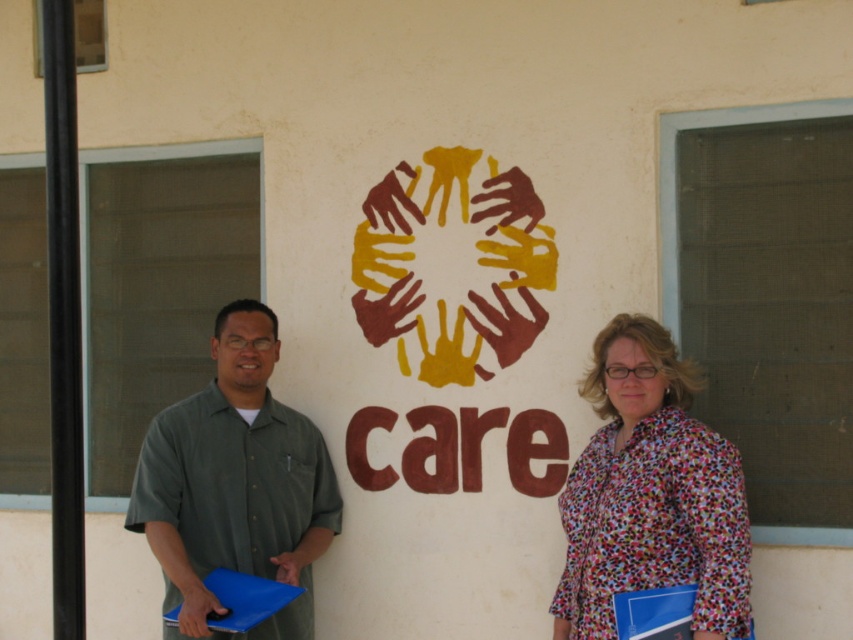
Question: Which point appears farthest from the camera in this image?

Choices:
 (A) (666, 364)
 (B) (256, 429)
 (C) (233, 355)
 (D) (453, 456)

Answer: (D)

Question: Is green fabric shirt at left below brown matte/ceramic sign at center?

Choices:
 (A) yes
 (B) no

Answer: (A)

Question: Does green shirt at left appear over printed fabric blouse at center?

Choices:
 (A) yes
 (B) no

Answer: (B)

Question: Which of the following is the farthest from the observer?

Choices:
 (A) (738, 465)
 (B) (268, 420)

Answer: (B)

Question: Which object is positioned closest to the printed fabric blouse at center?

Choices:
 (A) brown matte/ceramic sign at center
 (B) green shirt at left

Answer: (B)

Question: Is green shirt at left below printed fabric blouse at center?

Choices:
 (A) yes
 (B) no

Answer: (A)